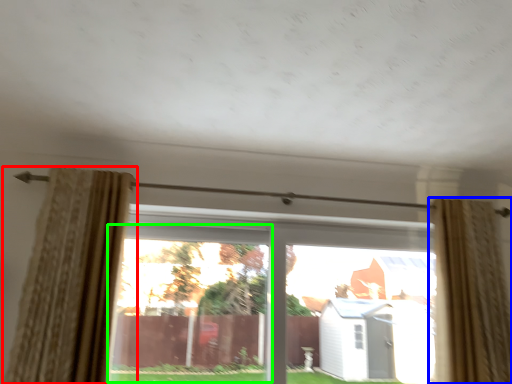
Question: Which object is the farthest from curtain (highlighted by a red box)? Choose among these: curtain (highlighted by a blue box) or window (highlighted by a green box).

Choices:
 (A) curtain
 (B) window

Answer: (A)